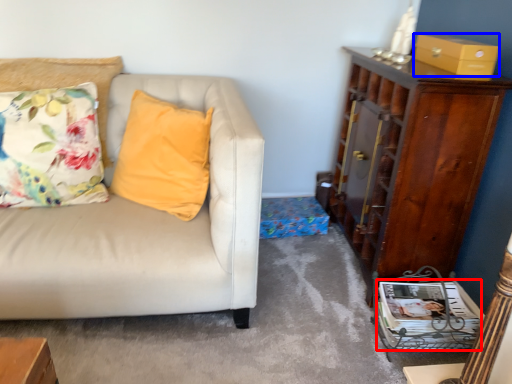
Question: Which object is closer to the camera taking this photo, magazine (highlighted by a red box) or box (highlighted by a blue box)?

Choices:
 (A) magazine
 (B) box

Answer: (B)